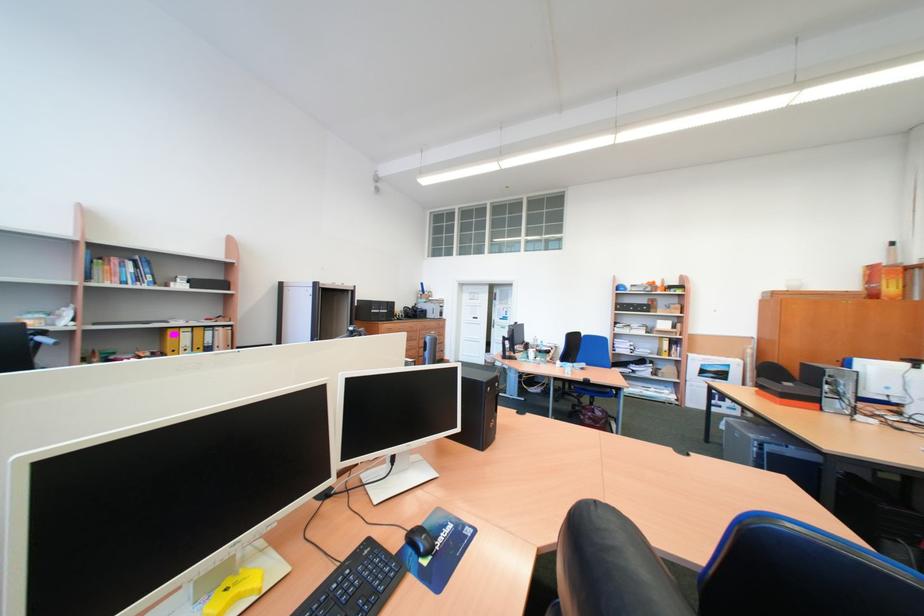
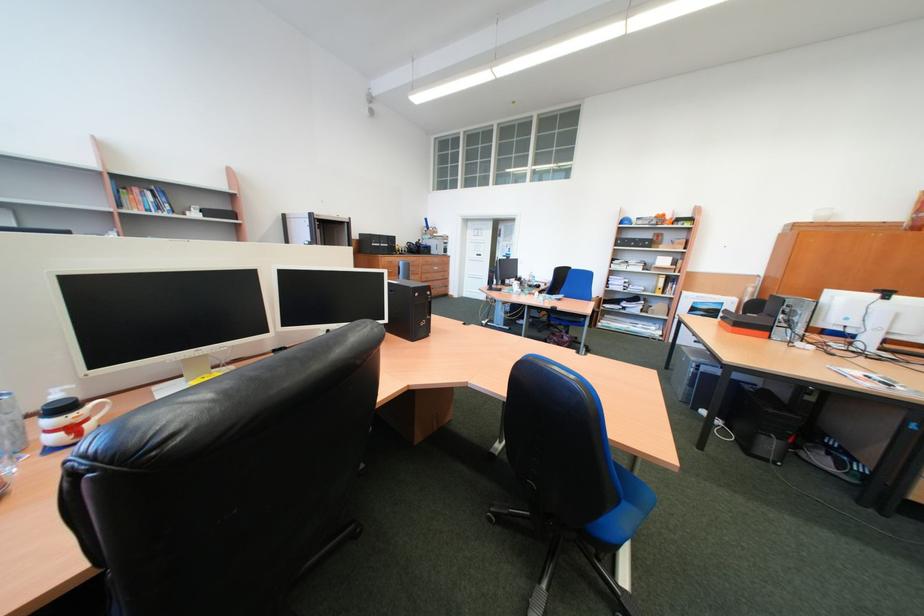
Locate, in the second image, the point that corresponds to [490,320] in the first image.

(493, 257)